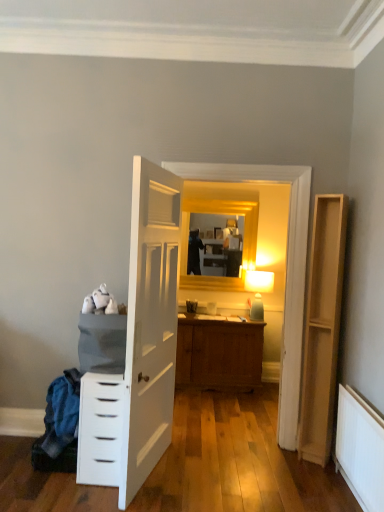
Find the location of a particular element. The width and height of the screenshot is (384, 512). free spot in front of white glossy chest of drawers at left is located at coordinates (76, 497).